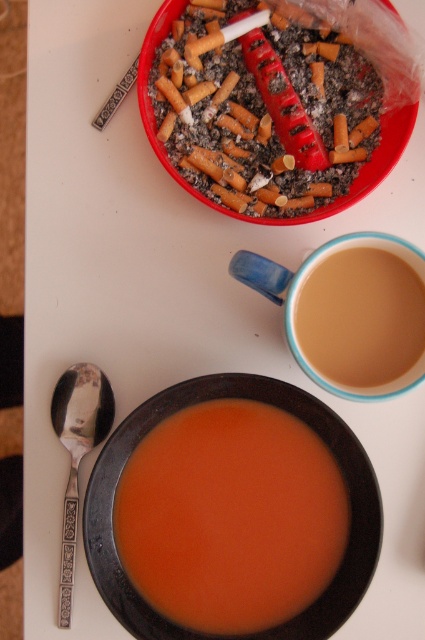
Does point (272, 29) lie behind point (299, 332)?

Yes.

Which is more to the right, red plastic ashtray at upper center or brown matte cup at center?

brown matte cup at center

Where is `red plastic ashtray at upper center`? red plastic ashtray at upper center is located at coordinates [x=265, y=104].

The image size is (425, 640). Identify the location of red plastic ashtray at upper center. (265, 104).

Who is higher up, red plastic ashtray at upper center or silver metallic spoon at lower left?

red plastic ashtray at upper center is higher up.

In the scene shown: Who is more distant from viewer, [204,32] or [65,433]?

The point [204,32] is more distant.

Is point (373, 145) farther from camera compared to point (65, 528)?

Yes.

Where is `red plastic ashtray at upper center`? The height and width of the screenshot is (640, 425). red plastic ashtray at upper center is located at coordinates (265, 104).

Does orange matte soup at center have a greater width compared to silver metallic spoon at lower left?

Indeed, orange matte soup at center has a greater width compared to silver metallic spoon at lower left.

Is orange matte soup at center closer to camera compared to silver metallic spoon at lower left?

That is True.

Locate an element on the screen. orange matte soup at center is located at coordinates (231, 516).